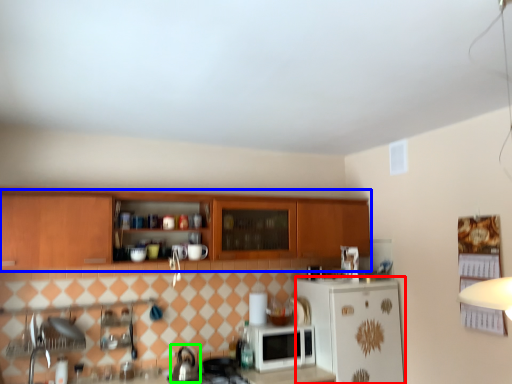
Question: Which object is the closest to the refrigerator (highlighted by a red box)? Choose among these: cabinetry (highlighted by a blue box) or tea pot (highlighted by a green box).

Choices:
 (A) cabinetry
 (B) tea pot

Answer: (A)